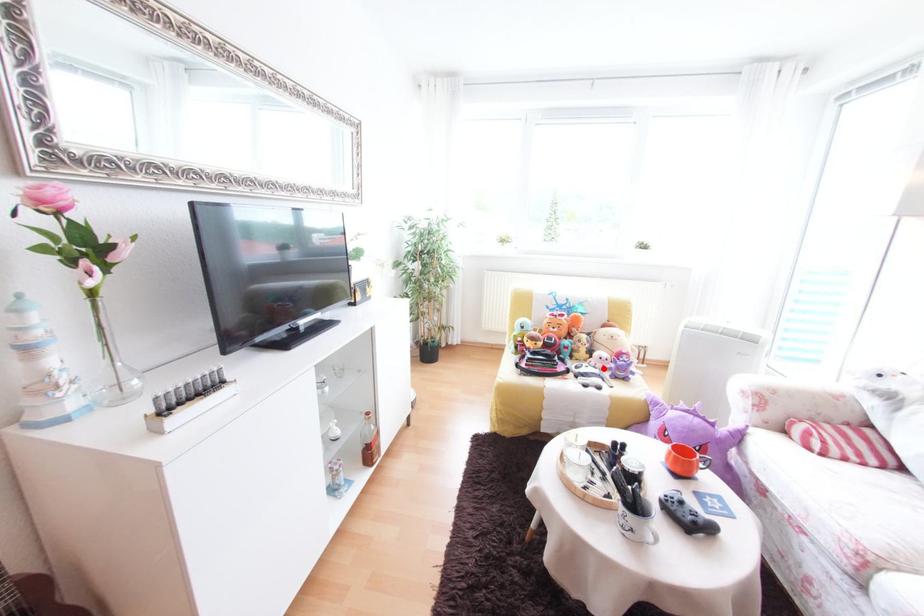
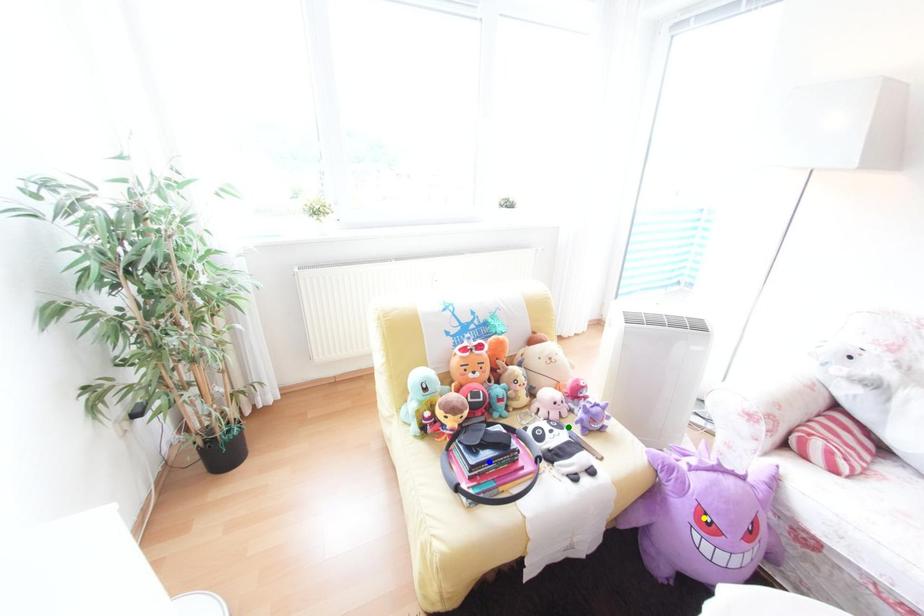
Question: I am providing you with two images of the same scene from different viewpoints. A red point is marked on the first image. You are given multiple points on the second image. Which spot in image 2 lines up with the point in image 1?

Choices:
 (A) yellow point
 (B) blue point
 (C) green point

Answer: (C)